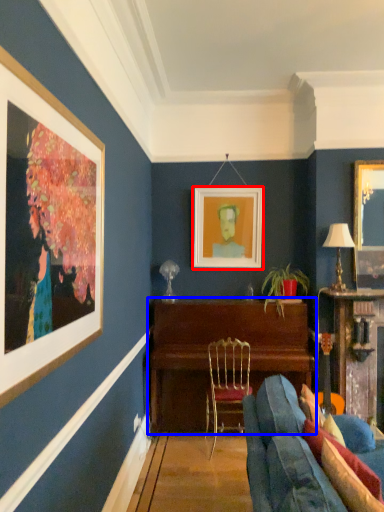
Question: Among these objects, which one is farthest to the camera, picture frame (highlighted by a red box) or table (highlighted by a blue box)?

Choices:
 (A) picture frame
 (B) table

Answer: (A)